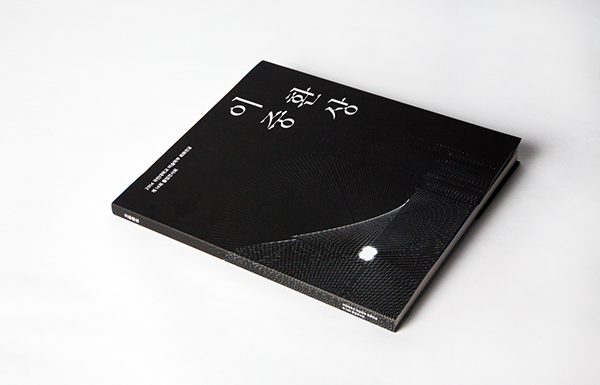
Find the location of a particular element. top cover of book is located at coordinates (393, 153).